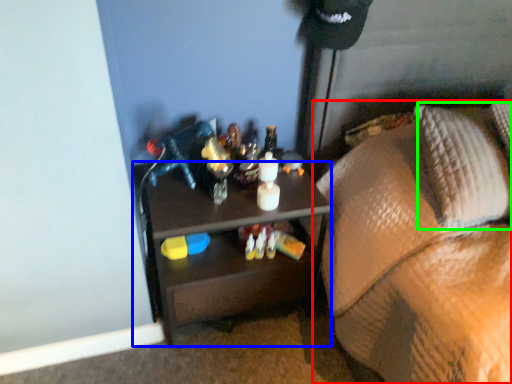
Question: Based on their relative distances, which object is farther from furniture (highlighted by a red box)? Choose from desk (highlighted by a blue box) and pillow (highlighted by a green box).

Choices:
 (A) desk
 (B) pillow

Answer: (A)